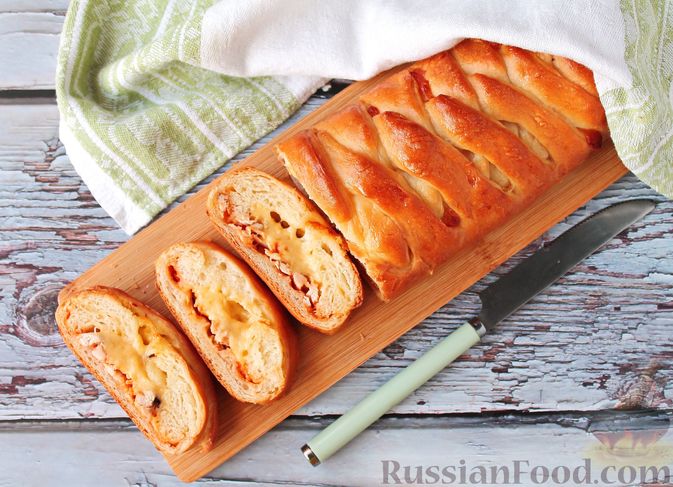
Identify the location of handle. The width and height of the screenshot is (673, 487). (385, 408).